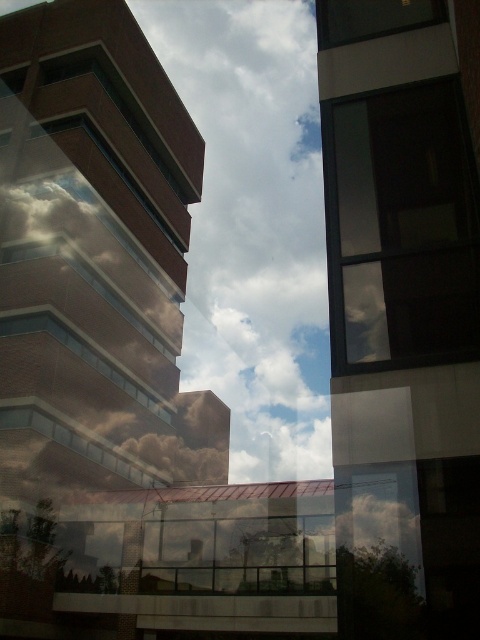
The width and height of the screenshot is (480, 640). What do you see at coordinates (254, 225) in the screenshot?
I see `white fluffy cloud at center` at bounding box center [254, 225].

Can you confirm if white fluffy cloud at center is wider than transparent glass window at upper right?

Yes, white fluffy cloud at center is wider than transparent glass window at upper right.

Based on the photo, who is more distant from viewer, (288, 376) or (375, 168)?

Point (288, 376)

Where is `white fluffy cloud at center`? white fluffy cloud at center is located at coordinates (254, 225).